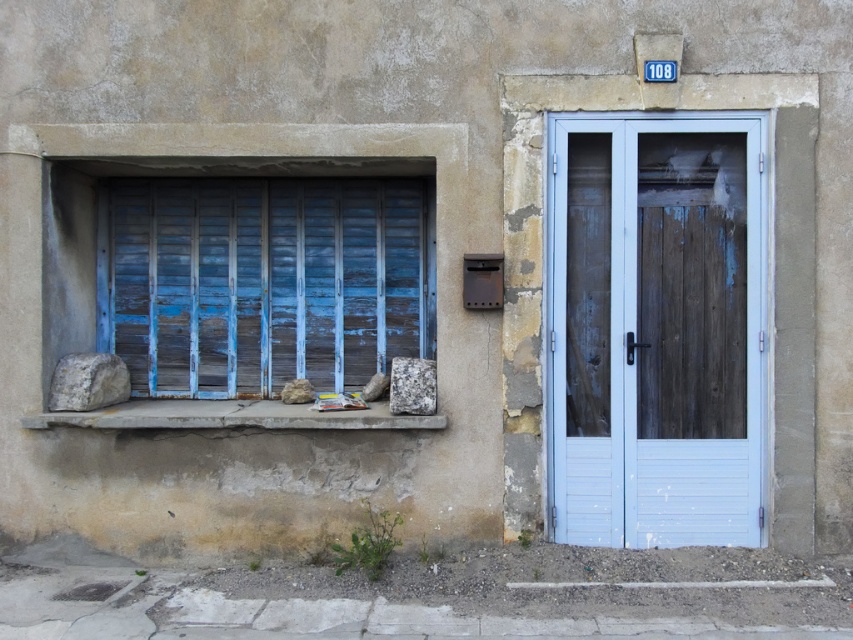
Question: Estimate the real-world distances between objects in this image. Which object is farther from the light blue wood door at center?

Choices:
 (A) granite rock at lower center
 (B) rusty concrete window sill at lower center

Answer: (B)

Question: Observing the image, what is the correct spatial positioning of rusty concrete window sill at lower center in reference to granite rock at lower center?

Choices:
 (A) left
 (B) right

Answer: (A)

Question: Where is light blue wood door at center located in relation to rusty concrete window sill at lower center in the image?

Choices:
 (A) below
 (B) above

Answer: (B)

Question: Among these objects, which one is farthest from the camera?

Choices:
 (A) rusty concrete window sill at lower center
 (B) light blue wood door at center
 (C) rusty metallic rock at lower center
 (D) granite rock at lower center

Answer: (C)

Question: Can you confirm if light blue wood door at center is positioned below rusty concrete window sill at lower center?

Choices:
 (A) no
 (B) yes

Answer: (A)

Question: Which of the following is the closest to the observer?

Choices:
 (A) gray rough rock at lower left
 (B) granite rock at lower center
 (C) light blue wood door at center

Answer: (C)